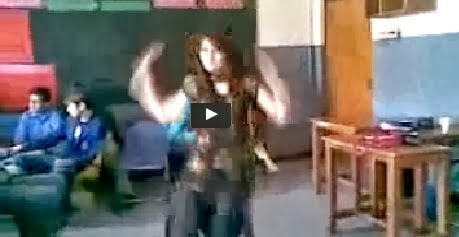
Where is `gray floor`? This screenshot has height=237, width=459. gray floor is located at coordinates [292, 204].